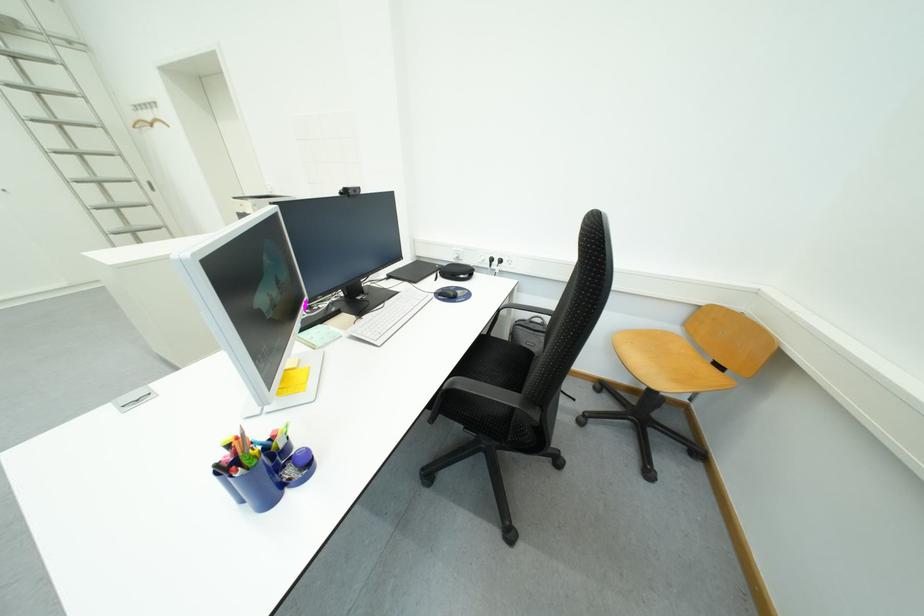
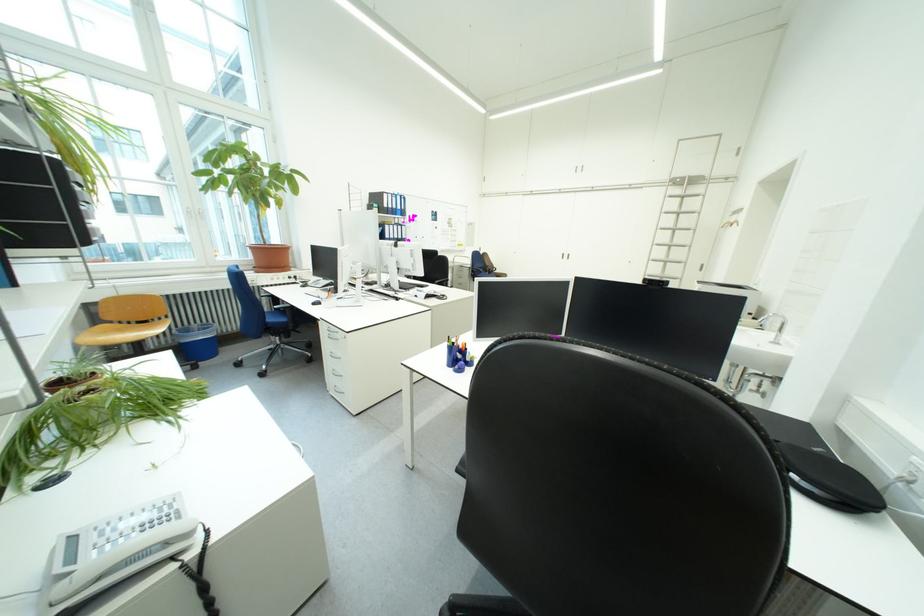
In the second image, find the point that corresponds to the point at 95,148 in the first image.

(687, 244)